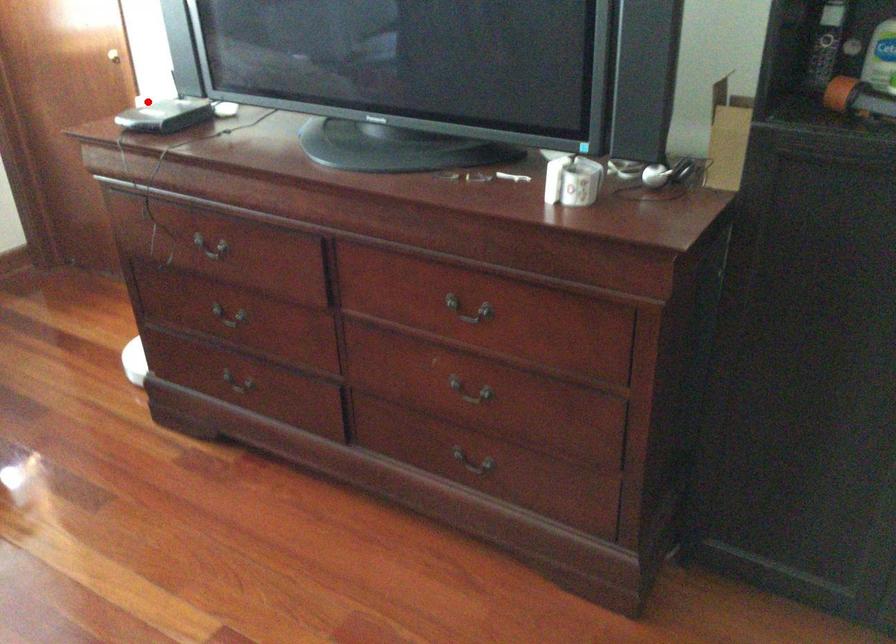
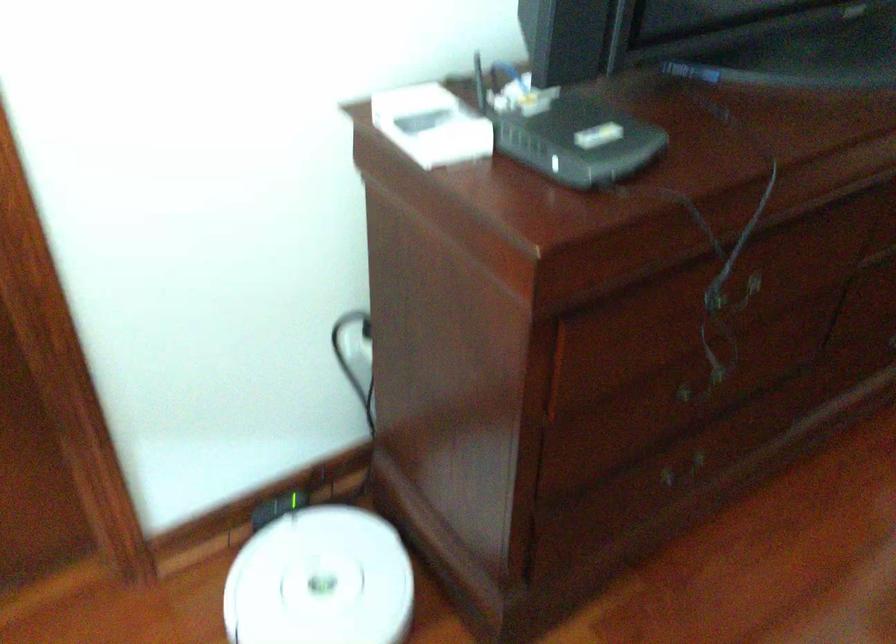
Question: I am providing you with two images of the same scene from different viewpoints. A red point is shown in image1. For the corresponding object point in image2, is it positioned nearer or farther from the camera?

Choices:
 (A) Nearer
 (B) Farther

Answer: (A)